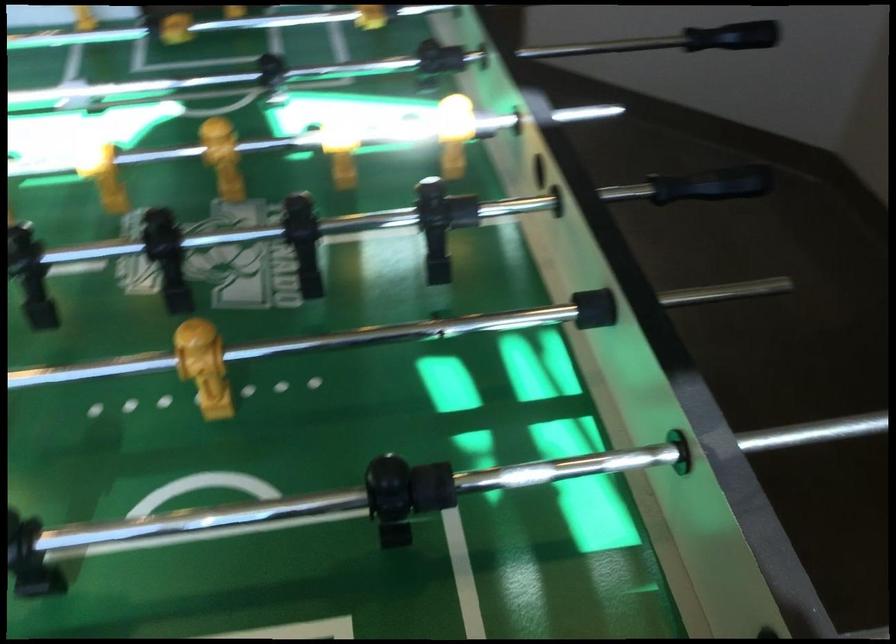
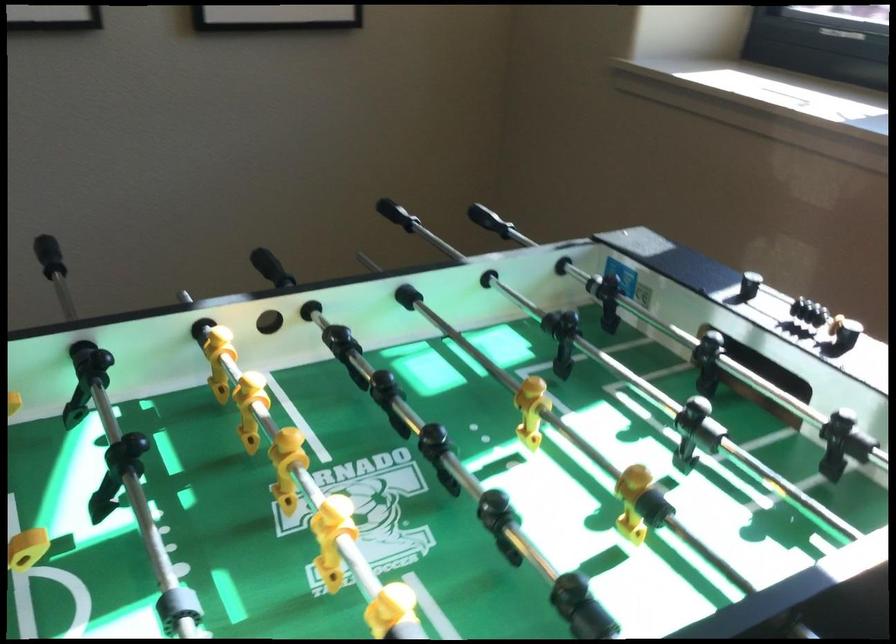
Where in the second image is the point corresponding to (x=712, y=202) from the first image?

(271, 268)